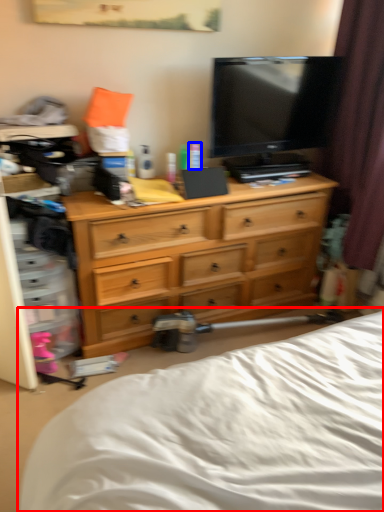
Question: Which point is closer to the camera, bed (highlighted by a red box) or toiletry (highlighted by a blue box)?

Choices:
 (A) bed
 (B) toiletry

Answer: (A)